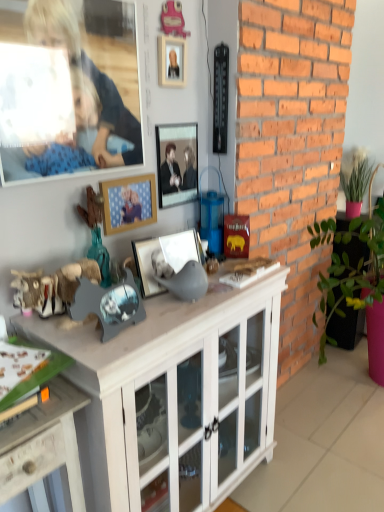
Question: Based on their positions, is matte silver picture frame at center, the 1th picture frame ordered from the bottom, located to the left or right of white wood cabinet at center?

Choices:
 (A) right
 (B) left

Answer: (B)

Question: Looking at their shapes, would you say matte silver picture frame at center, the 1th picture frame ordered from the bottom, is wider or thinner than white wood cabinet at center?

Choices:
 (A) wide
 (B) thin

Answer: (B)

Question: Which object is the closest to the wooden photo frame at center, arranged as the 2th picture frame when ordered from the bottom?

Choices:
 (A) white wood cabinet at center
 (B) smooth wooden frame at upper left
 (C) matte silver picture frame at center, the 3th picture frame positioned from the top
 (D) wooden desk at lower left
 (E) metallic silver picture frame at center, which is the third picture frame in bottom-to-top order

Answer: (E)

Question: Considering the real-world distances, which object is farthest from the wooden photo frame at center, which appears as the 2th picture frame when viewed from the top?

Choices:
 (A) white wood cabinet at center
 (B) wooden desk at lower left
 (C) metallic silver picture frame at center, which is the third picture frame in bottom-to-top order
 (D) smooth wooden frame at upper left
 (E) matte silver picture frame at center, the 3th picture frame positioned from the top

Answer: (B)